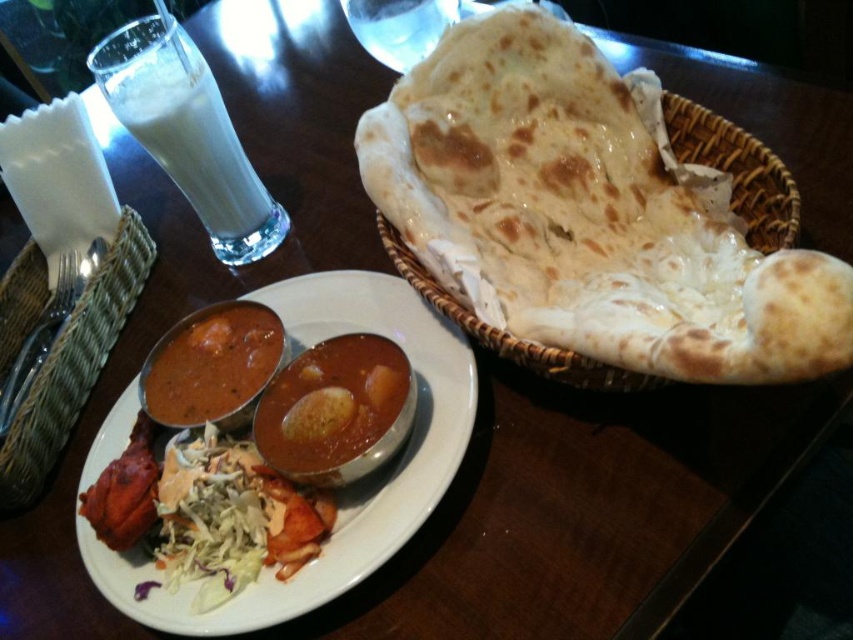
You are a food critic evaluating the consistency of the curries on the plate. Which of the two curries, the smokey brown matte curry at center or the smooth brown curry at center, has a thicker texture?

The smooth brown curry at center has a thicker texture because the smokey brown matte curry at center is thinner than it.

You are a diner who wants to reach for the brown woven basket at upper right and the smokey brown matte curry at center. Which one is taller?

The brown woven basket at upper right is taller than the smokey brown matte curry at center.

You are a food delivery person who needs to place a hot pad at point (654, 385) to protect the table from a hot dish. The hot pad has a diameter of 12 inches. Can you fit the hot pad at that point without overlapping any other items on the table?

The point (654, 385) is 18.89 inches away from the camera. Since the hot pad has a diameter of 12 inches, there is enough space around the point to place it without overlapping other items.